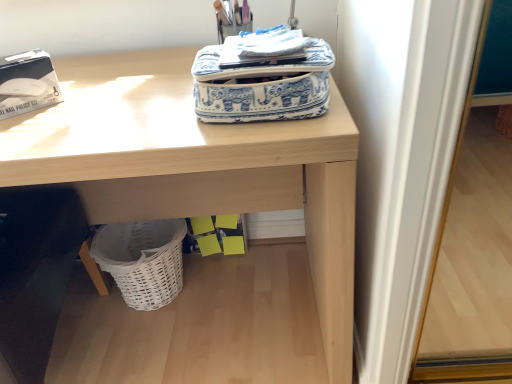
This screenshot has height=384, width=512. In order to click on blank space above blue and white fabric bag at upper center (from a real-world perspective) in this screenshot , I will do `click(270, 39)`.